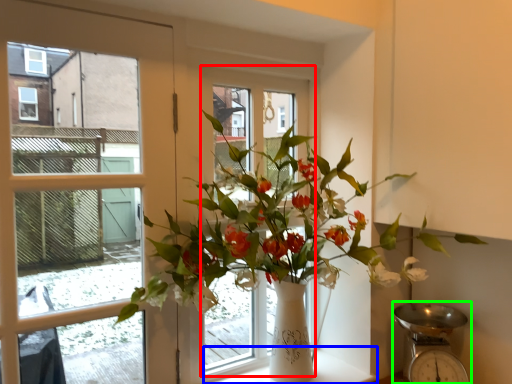
Question: Which object is the farthest from window frame (highlighted by a red box)? Choose among these: window sill (highlighted by a blue box) or scale (highlighted by a green box).

Choices:
 (A) window sill
 (B) scale

Answer: (A)